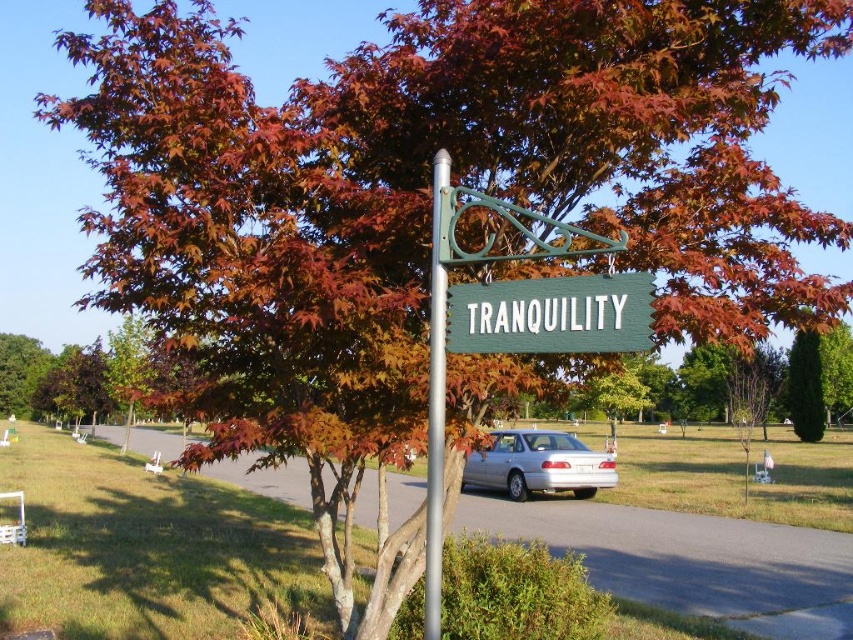
You are a landscape architect planning to place a new bench in the garden. The bench requires a space of 10 meters between the green wood sign at center and the green textured hedge at center. Based on the image, is the available space sufficient for the bench?

The green wood sign at center and green textured hedge at center are 11.02 meters apart from each other, so the available space is sufficient for the bench which requires 10 meters between them.

You are a delivery person who needs to park your 1.8 meters tall delivery box next to the silver metallic sedan at center and the green textured hedge at center. Based on the scene, can you place the box between them without it being too tall?

The silver metallic sedan at center is not as tall as green textured hedge at center, so the delivery box at 1.8 meters tall can be placed between them since it is shorter than both objects.

From the picture: You are a landscape designer planning to install a new decorative element between the green wooden sign at center and the silver metallic pole at center. Considering their sizes, which object should you place closer to the sign to maintain visual balance?

The green wooden sign at center is larger in size than the silver metallic pole at center. To maintain visual balance, you should place the new decorative element closer to the green wooden sign at center since it is larger and requires more space for balance.